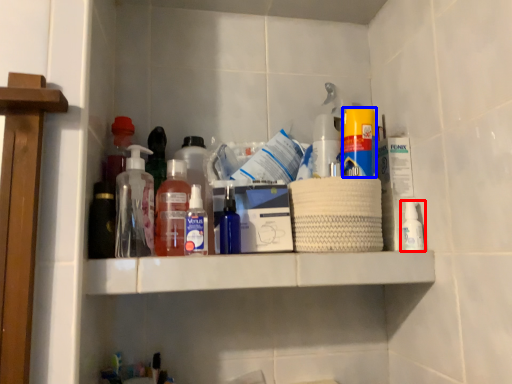
Question: Which object is further to the camera taking this photo, bottle (highlighted by a red box) or cleaning product (highlighted by a blue box)?

Choices:
 (A) bottle
 (B) cleaning product

Answer: (A)